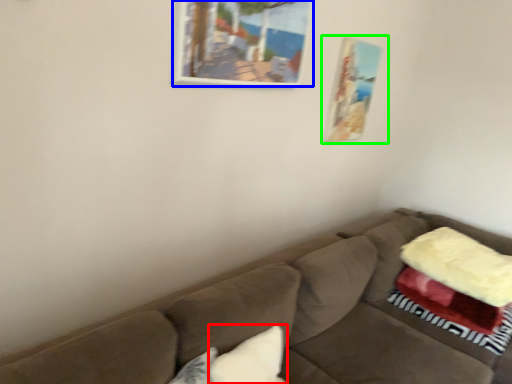
Question: Which object is the closest to the pillow (highlighted by a red box)? Choose among these: picture frame (highlighted by a blue box) or picture frame (highlighted by a green box).

Choices:
 (A) picture frame
 (B) picture frame

Answer: (A)